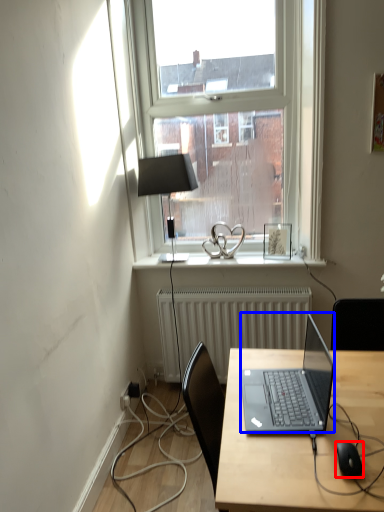
Question: Which point is closer to the camera, computer mouse (highlighted by a red box) or laptop (highlighted by a blue box)?

Choices:
 (A) computer mouse
 (B) laptop

Answer: (A)